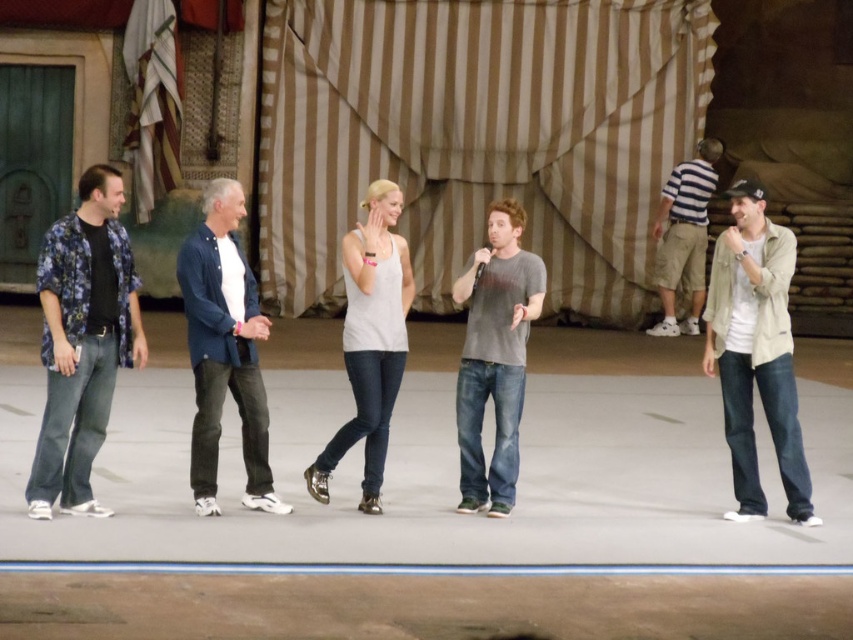
Question: Does beige cotton jacket at right appear under blue denim shirt at center?

Choices:
 (A) yes
 (B) no

Answer: (A)

Question: Which object appears closest to the camera in this image?

Choices:
 (A) gray cotton t-shirt at center
 (B) white matte tank top at center

Answer: (B)

Question: Estimate the real-world distances between objects in this image. Which object is farther from the beige cotton jacket at right?

Choices:
 (A) white matte tank top at center
 (B) floral print shirt at left
 (C) gray cotton t-shirt at center
 (D) striped shirt at right

Answer: (D)

Question: Is white matte tank top at center closer to camera compared to striped shirt at right?

Choices:
 (A) yes
 (B) no

Answer: (A)

Question: Which of the following is the farthest from the observer?

Choices:
 (A) (349, 321)
 (B) (686, 324)

Answer: (B)

Question: Is blue denim shirt at center below white matte tank top at center?

Choices:
 (A) no
 (B) yes

Answer: (B)